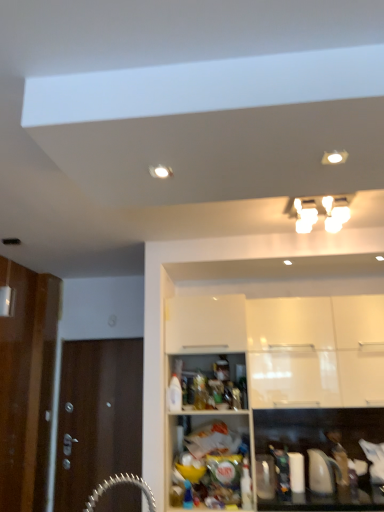
Locate an element on the screen. vacant point above brown wooden door at left (from a real-world perspective) is located at coordinates (101, 338).